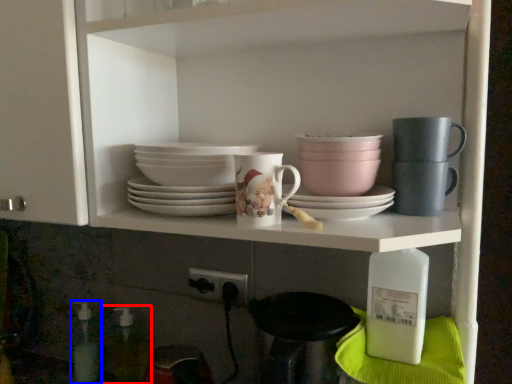
Question: Which object is closer to the camera taking this photo, bottle (highlighted by a red box) or bottle (highlighted by a blue box)?

Choices:
 (A) bottle
 (B) bottle

Answer: (A)